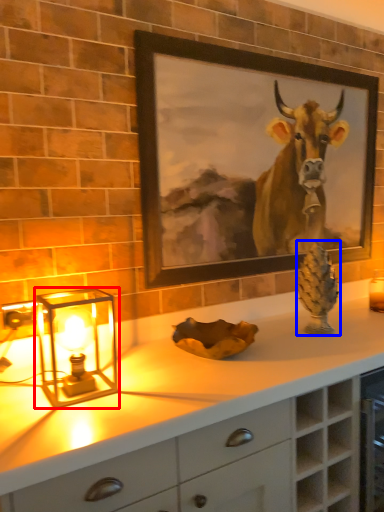
Question: Which object is closer to the camera taking this photo, table lamp (highlighted by a red box) or pine cone (highlighted by a blue box)?

Choices:
 (A) table lamp
 (B) pine cone

Answer: (A)